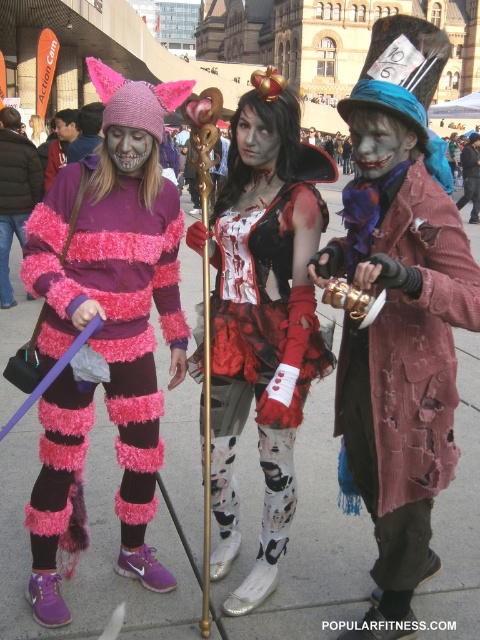
Is the position of matte black dress at center less distant than that of rusty metal teapot at center?

No, matte black dress at center is behind rusty metal teapot at center.

How distant is matte black dress at center from rusty metal teapot at center?

matte black dress at center and rusty metal teapot at center are 6.10 meters apart from each other.

Find the location of a particular element. The image size is (480, 640). matte black dress at center is located at coordinates (264, 317).

Which of these two, fuzzy pink and purple striped sweater at left or pink fuzzy costume at center, stands taller?

fuzzy pink and purple striped sweater at left is taller.

Who is positioned more to the left, fuzzy pink and purple striped sweater at left or pink fuzzy costume at center?

pink fuzzy costume at center is more to the left.

Which is behind, point (113, 323) or point (0, 289)?

Positioned behind is point (0, 289).

This screenshot has height=640, width=480. What are the coordinates of `fuzzy pink and purple striped sweater at left` in the screenshot? It's located at (113, 310).

Describe the element at coordinates (113, 310) in the screenshot. I see `fuzzy pink and purple striped sweater at left` at that location.

Is fuzzy pink and purple striped sweater at left bigger than matte black face paint at center?

Yes.

Who is more distant from viewer, (59, 504) or (76, 132)?

The point (76, 132) is more distant.

Locate an element on the screen. This screenshot has width=480, height=640. fuzzy pink and purple striped sweater at left is located at coordinates (113, 310).